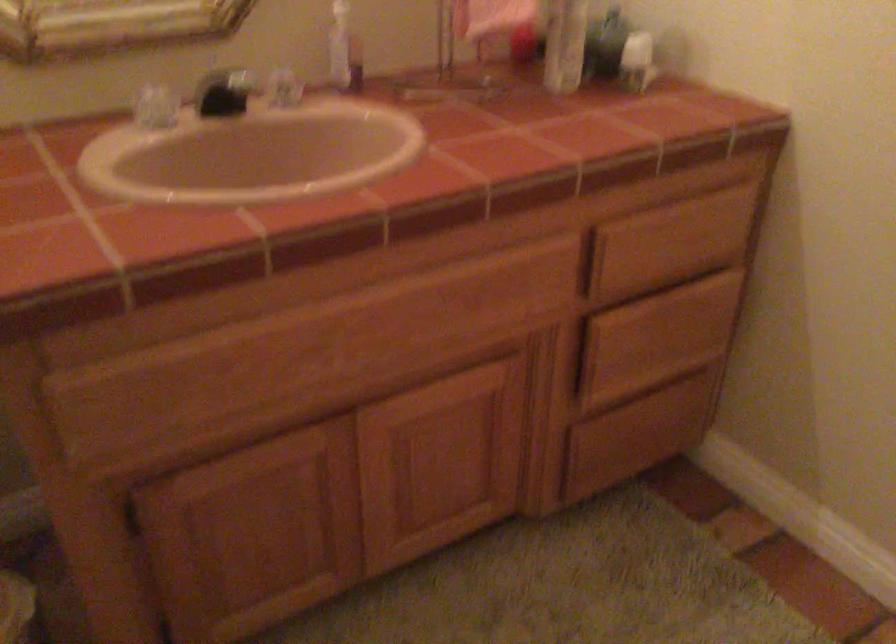
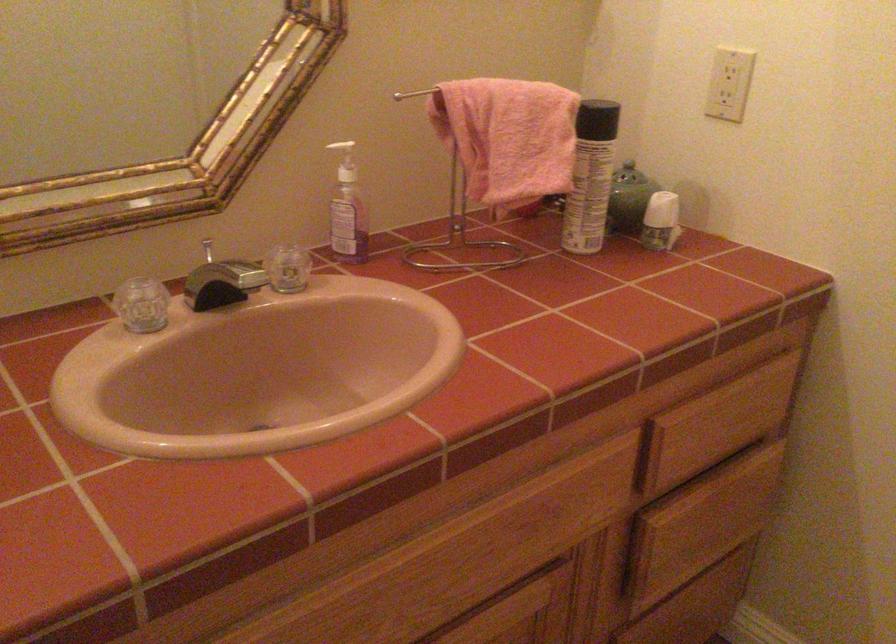
In the second image, find the point that corresponds to pixel 647 336 in the first image.

(701, 524)